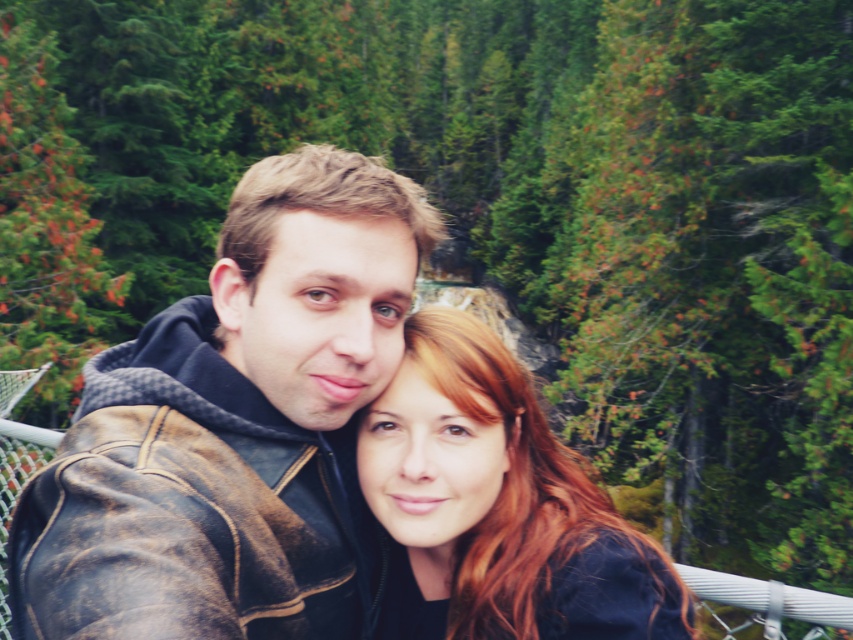
Question: Does brown leather jacket at center appear on the left side of matte black hair at center?

Choices:
 (A) yes
 (B) no

Answer: (A)

Question: Which point is closer to the camera taking this photo?

Choices:
 (A) (363, 221)
 (B) (602, 612)

Answer: (B)

Question: Observing the image, what is the correct spatial positioning of brown leather jacket at center in reference to matte black hair at center?

Choices:
 (A) above
 (B) below

Answer: (A)

Question: Does brown leather jacket at center appear on the right side of matte black hair at center?

Choices:
 (A) yes
 (B) no

Answer: (B)